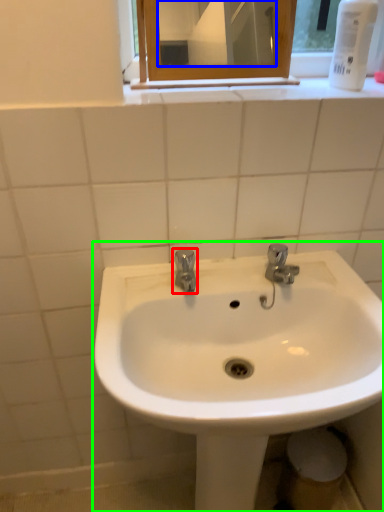
Question: Estimate the real-world distances between objects in this image. Which object is closer to tap (highlighted by a red box), mirror (highlighted by a blue box) or sink (highlighted by a green box)?

Choices:
 (A) mirror
 (B) sink

Answer: (B)